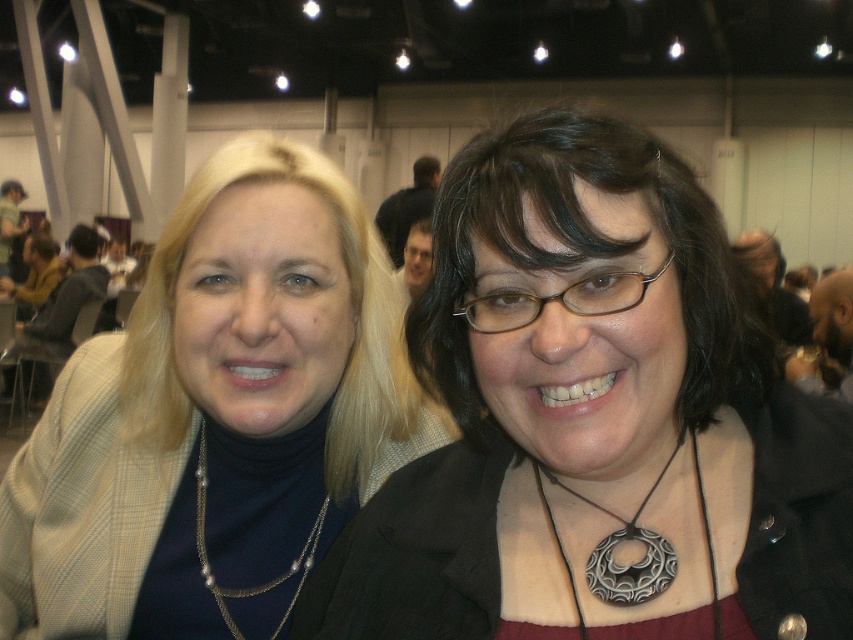
Is black matte necklace at center further to the viewer compared to matte gold jacket at left?

No, it is not.

Is black matte necklace at center taller than matte gold jacket at left?

No, black matte necklace at center is not taller than matte gold jacket at left.

Find the location of a particular element. This screenshot has height=640, width=853. black matte necklace at center is located at coordinates (595, 420).

Is black matte necklace at center above pearl/gold chain necklace at center?

Correct, black matte necklace at center is located above pearl/gold chain necklace at center.

Which is behind, point (619, 582) or point (297, 467)?

The point (297, 467) is more distant.

You are a GUI agent. You are given a task and a screenshot of the screen. Output one action in this format:
    pyautogui.click(x=<x>, y=<y>)
    Task: Click on the black matte necklace at center
    
    Given the screenshot: What is the action you would take?
    (595, 420)

What do you see at coordinates (595, 420) in the screenshot? I see `black matte necklace at center` at bounding box center [595, 420].

The width and height of the screenshot is (853, 640). Identify the location of black matte necklace at center. (595, 420).

Is point (527, 413) positioned before point (640, 588)?

Yes, point (527, 413) is in front of point (640, 588).

I want to click on black matte necklace at center, so click(x=595, y=420).